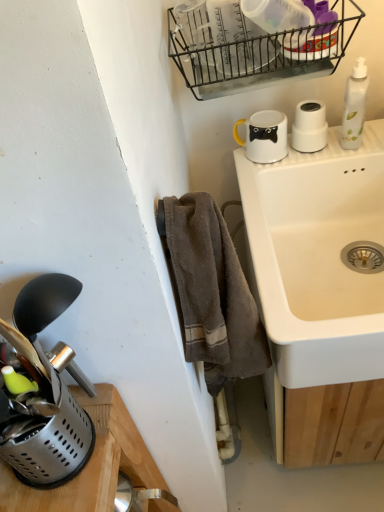
Question: From the image's perspective, is white matte cup at upper right, which is the 3th appliance in left-to-right order, located beneath metallic silver utensil holder at lower left, which is counted as the third appliance, starting from the back?

Choices:
 (A) yes
 (B) no

Answer: (B)

Question: Is white matte cup at upper right, the 3th appliance when ordered from front to back, to the right of metallic silver utensil holder at lower left, the 3th appliance positioned from the right, from the viewer's perspective?

Choices:
 (A) yes
 (B) no

Answer: (A)

Question: Considering the relative sizes of white matte cup at upper right, which is the 3th appliance in left-to-right order, and metallic silver utensil holder at lower left, which is counted as the third appliance, starting from the back, in the image provided, is white matte cup at upper right, which is the 3th appliance in left-to-right order, bigger than metallic silver utensil holder at lower left, which is counted as the third appliance, starting from the back,?

Choices:
 (A) yes
 (B) no

Answer: (B)

Question: Can you see white matte cup at upper right, which is the 3th appliance in left-to-right order, touching metallic silver utensil holder at lower left, the 3th appliance from the top?

Choices:
 (A) yes
 (B) no

Answer: (B)

Question: From a real-world perspective, is white matte cup at upper right, the 3th appliance when ordered from front to back, over metallic silver utensil holder at lower left, the 3th appliance positioned from the right?

Choices:
 (A) no
 (B) yes

Answer: (B)

Question: Looking at their shapes, would you say white translucent bottle at upper right is wider or thinner than brown cotton towel at lower center?

Choices:
 (A) wide
 (B) thin

Answer: (B)

Question: Would you say white translucent bottle at upper right is inside or outside brown cotton towel at lower center?

Choices:
 (A) outside
 (B) inside

Answer: (A)

Question: From a real-world perspective, is white translucent bottle at upper right above or below brown cotton towel at lower center?

Choices:
 (A) below
 (B) above

Answer: (B)

Question: From the image's perspective, is white translucent bottle at upper right above or below brown cotton towel at lower center?

Choices:
 (A) above
 (B) below

Answer: (A)

Question: From a real-world perspective, relative to black wire basket at upper center, is metallic silver utensil holder at lower left, the 3th appliance from the top, vertically above or below?

Choices:
 (A) below
 (B) above

Answer: (A)

Question: Is point (26, 425) positioned closer to the camera than point (324, 64)?

Choices:
 (A) farther
 (B) closer

Answer: (B)

Question: Based on their sizes in the image, would you say metallic silver utensil holder at lower left, which is counted as the third appliance, starting from the back, is bigger or smaller than black wire basket at upper center?

Choices:
 (A) small
 (B) big

Answer: (A)

Question: From their relative heights in the image, would you say metallic silver utensil holder at lower left, positioned as the 1th appliance in left-to-right order, is taller or shorter than black wire basket at upper center?

Choices:
 (A) tall
 (B) short

Answer: (A)

Question: Considering the relative positions of black wire basket at upper center and white glossy mug at upper center, the second appliance when ordered from back to front, in the image provided, is black wire basket at upper center to the left or to the right of white glossy mug at upper center, the second appliance when ordered from back to front,?

Choices:
 (A) right
 (B) left

Answer: (B)

Question: Do you think black wire basket at upper center is within white glossy mug at upper center, the second appliance from the right, or outside of it?

Choices:
 (A) inside
 (B) outside

Answer: (B)